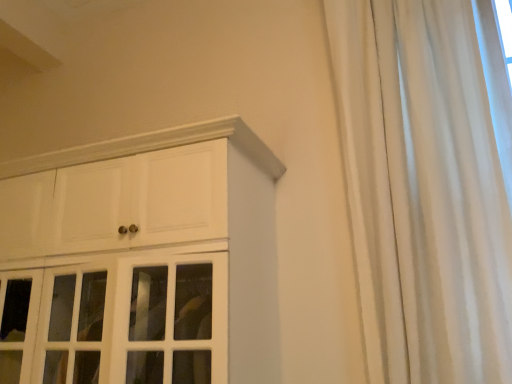
Question: Does white glossy cabinet at upper left have a greater height compared to white silky curtain at right?

Choices:
 (A) no
 (B) yes

Answer: (A)

Question: Is white glossy cabinet at upper left turned away from white silky curtain at right?

Choices:
 (A) yes
 (B) no

Answer: (B)

Question: From the image's perspective, is white glossy cabinet at upper left below white silky curtain at right?

Choices:
 (A) yes
 (B) no

Answer: (A)

Question: Is white glossy cabinet at upper left wider than white silky curtain at right?

Choices:
 (A) yes
 (B) no

Answer: (A)

Question: Considering the relative positions of white glossy cabinet at upper left and white silky curtain at right in the image provided, is white glossy cabinet at upper left behind white silky curtain at right?

Choices:
 (A) yes
 (B) no

Answer: (A)

Question: Is white glossy cabinet at upper left shorter than white silky curtain at right?

Choices:
 (A) no
 (B) yes

Answer: (B)

Question: Is white silky curtain at right smaller than white glossy cabinet at upper left?

Choices:
 (A) no
 (B) yes

Answer: (B)

Question: From a real-world perspective, does white silky curtain at right stand above white glossy cabinet at upper left?

Choices:
 (A) yes
 (B) no

Answer: (A)

Question: Is white silky curtain at right at the left side of white glossy cabinet at upper left?

Choices:
 (A) no
 (B) yes

Answer: (A)

Question: Is the depth of white silky curtain at right greater than that of white glossy cabinet at upper left?

Choices:
 (A) no
 (B) yes

Answer: (A)

Question: Considering the relative sizes of white silky curtain at right and white glossy cabinet at upper left in the image provided, is white silky curtain at right thinner than white glossy cabinet at upper left?

Choices:
 (A) no
 (B) yes

Answer: (B)

Question: Does white silky curtain at right contain white glossy cabinet at upper left?

Choices:
 (A) no
 (B) yes

Answer: (A)

Question: Is white glossy cabinet at upper left inside or outside of white silky curtain at right?

Choices:
 (A) inside
 (B) outside

Answer: (B)